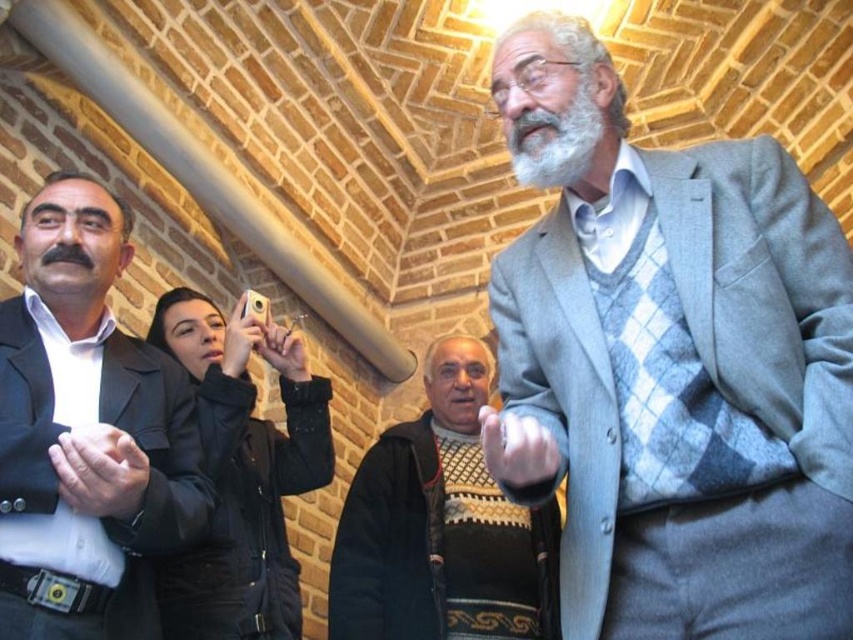
Question: Which point is farther to the camera?

Choices:
 (A) black matte suit at left
 (B) knitted sweater at center
 (C) gray woolen suit at upper right

Answer: (B)

Question: Which point is closer to the camera?

Choices:
 (A) gray woolen suit at upper right
 (B) dark gray woolen suit at center
 (C) knitted sweater at center

Answer: (A)

Question: Does knitted sweater at center come in front of dark gray woolen suit at center?

Choices:
 (A) yes
 (B) no

Answer: (B)

Question: Does black matte suit at left have a larger size compared to gray/white hair at upper right?

Choices:
 (A) yes
 (B) no

Answer: (A)

Question: Observing the image, what is the correct spatial positioning of knitted sweater at center in reference to gray/white hair at upper right?

Choices:
 (A) above
 (B) below

Answer: (B)

Question: Which point is farther to the camera?

Choices:
 (A) black matte suit at left
 (B) knitted sweater at center
 (C) gray woolen suit at upper right

Answer: (B)